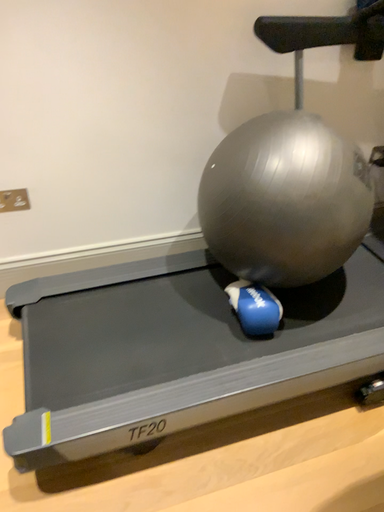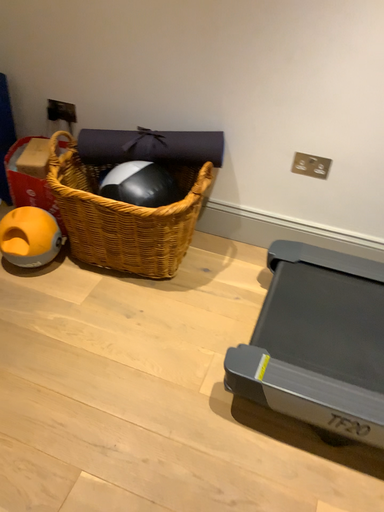
Question: Which way did the camera rotate in the video?

Choices:
 (A) rotated right
 (B) rotated left

Answer: (B)